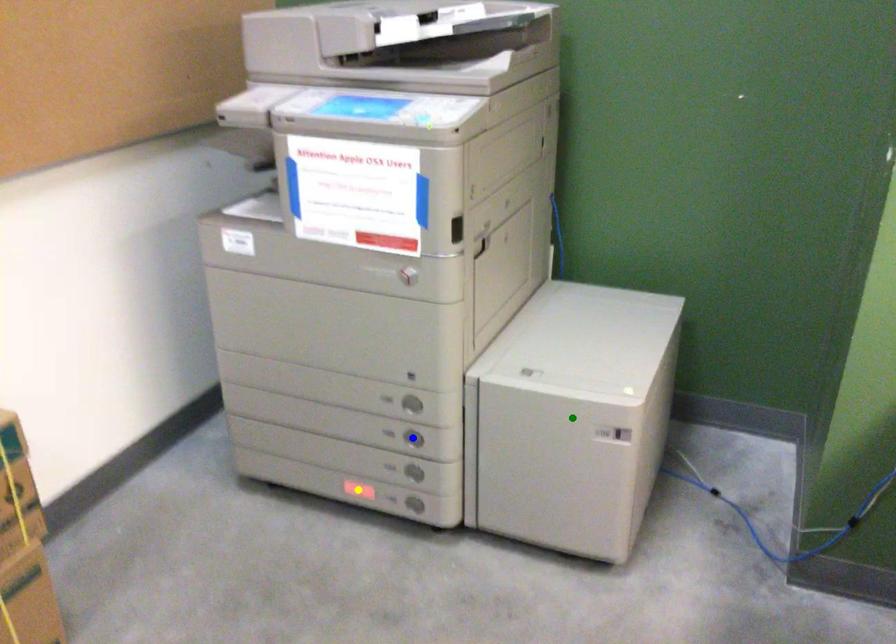
Order these from nearest to farthest:
A) yellow point
B) blue point
C) green point

1. green point
2. blue point
3. yellow point